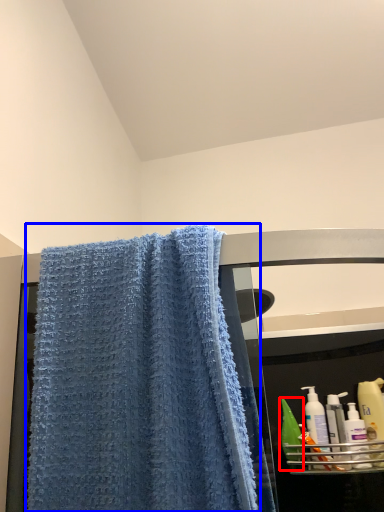
Question: Which object appears farthest to the camera in this image, mouthwash (highlighted by a red box) or towel (highlighted by a blue box)?

Choices:
 (A) mouthwash
 (B) towel

Answer: (A)